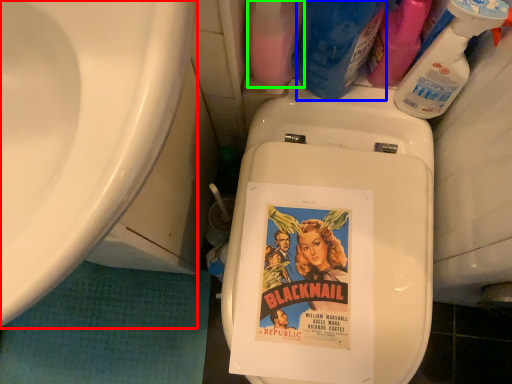
Question: Considering the real-world distances, which object is closest to sink (highlighted by a red box)? cleaning product (highlighted by a blue box) or cleaning product (highlighted by a green box).

Choices:
 (A) cleaning product
 (B) cleaning product

Answer: (B)